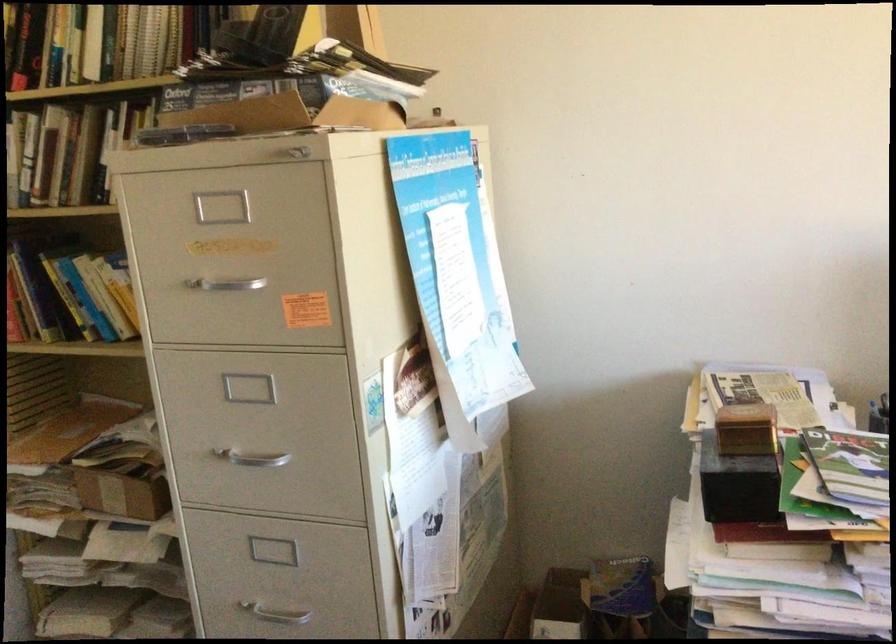
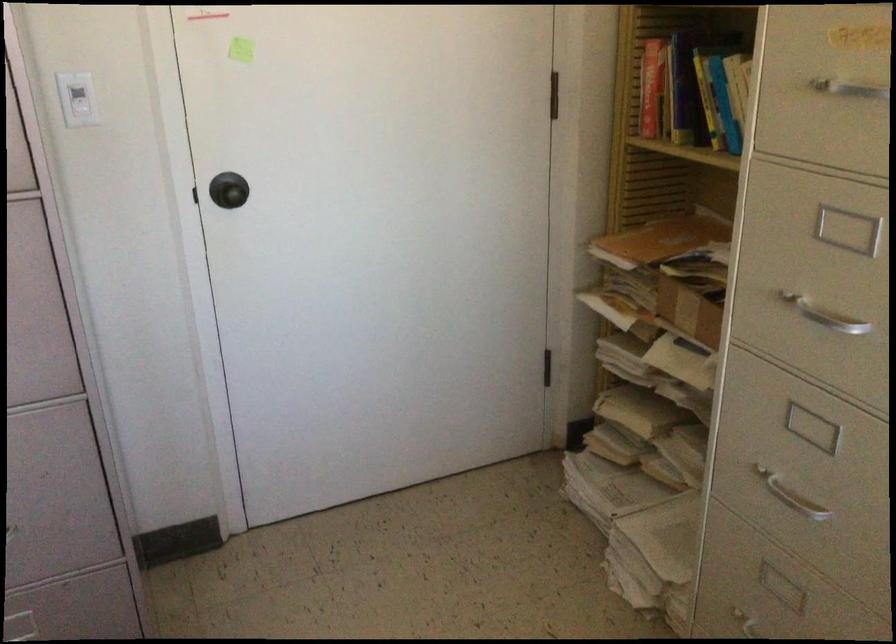
Find the pixel in the second image that matches pixel 256 451 in the first image.

(824, 315)